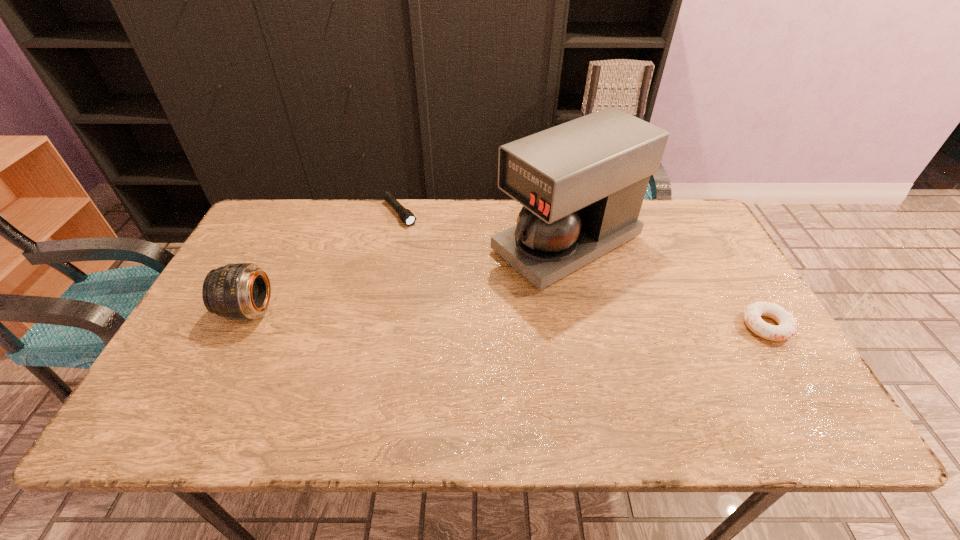
The width and height of the screenshot is (960, 540). Identify the location of vacant spot on the desktop that is between the third shortest object and the doughnut and is positioned on the carafe side of the tallest object. (428, 316).

Locate an element on the screen. vacant space on the desktop that is between the second tallest object and the rightmost object and is positioned at the lens end of the flashlight is located at coordinates (498, 318).